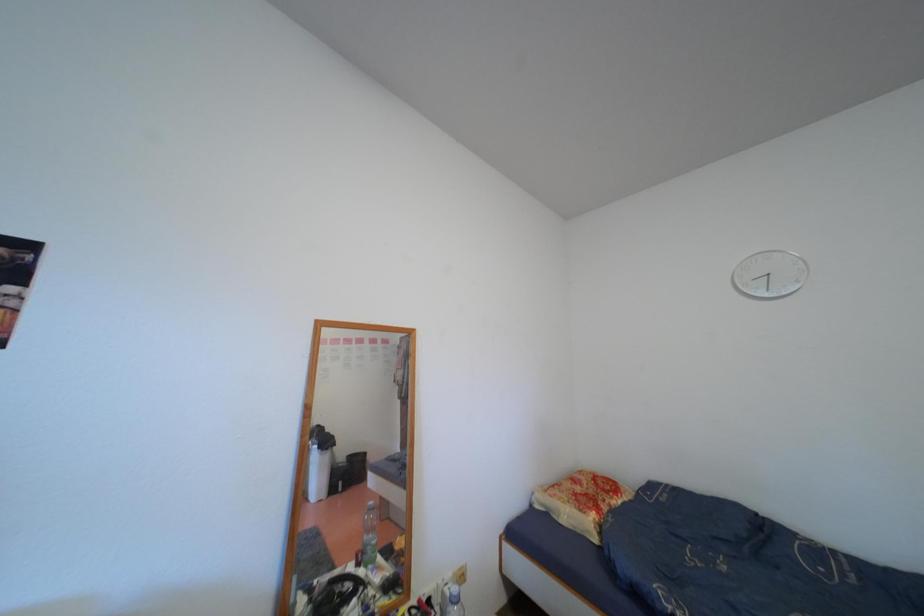
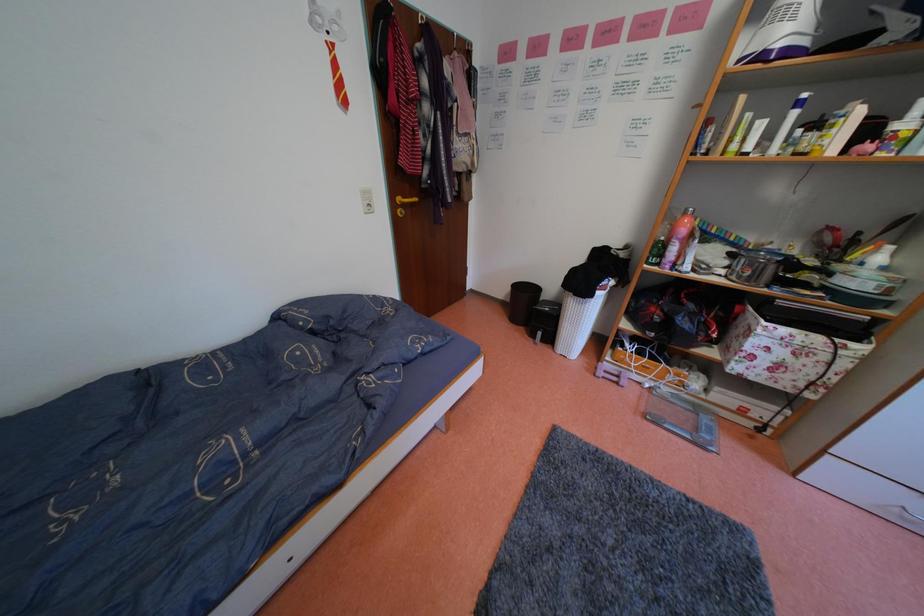
Based on the continuous images, in which direction is the camera rotating?

The rotation direction of the camera is right-down.